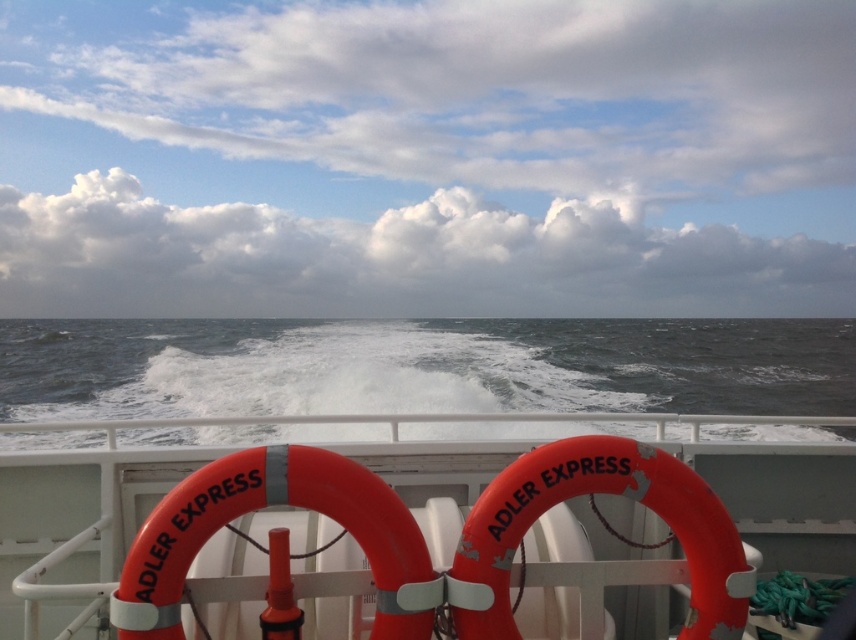
Question: Does orange rubber lifebuoy at center come in front of orange rubber life ring at center?

Choices:
 (A) no
 (B) yes

Answer: (A)

Question: Among these points, which one is farthest from the camera?

Choices:
 (A) (318, 561)
 (B) (153, 324)

Answer: (B)

Question: Does orange rubber lifebuoy at center appear under orange rubber life ring at center?

Choices:
 (A) no
 (B) yes

Answer: (B)

Question: Which of the following is the closest to the observer?

Choices:
 (A) orange rubber lifebuoy at center
 (B) dark gray water at center

Answer: (A)

Question: Does orange rubber lifebuoy at center come behind orange rubber life ring at center?

Choices:
 (A) no
 (B) yes

Answer: (B)

Question: Among these points, which one is farthest from the camera?

Choices:
 (A) (135, 525)
 (B) (28, 412)
 (C) (389, 634)

Answer: (B)